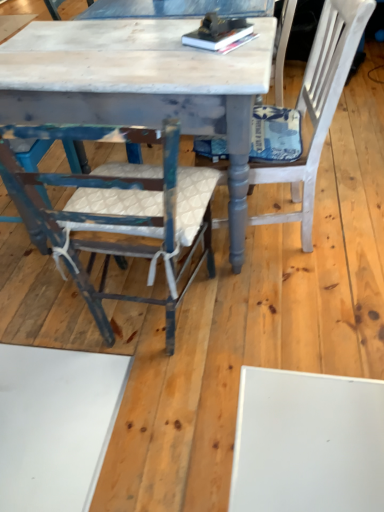
Question: Does white textured cushion at right, the first chair positioned from the right, have a larger size compared to hardcover books at center?

Choices:
 (A) no
 (B) yes

Answer: (B)

Question: Is white textured cushion at right, which is the second chair from left to right, surrounding hardcover books at center?

Choices:
 (A) no
 (B) yes

Answer: (B)

Question: Considering the relative sizes of white textured cushion at right, which is the second chair from left to right, and hardcover books at center in the image provided, is white textured cushion at right, which is the second chair from left to right, taller than hardcover books at center?

Choices:
 (A) no
 (B) yes

Answer: (B)

Question: Considering the relative sizes of white textured cushion at right, the first chair positioned from the right, and hardcover books at center in the image provided, is white textured cushion at right, the first chair positioned from the right, wider than hardcover books at center?

Choices:
 (A) no
 (B) yes

Answer: (B)

Question: From the image's perspective, would you say white textured cushion at right, the first chair positioned from the right, is shown under hardcover books at center?

Choices:
 (A) no
 (B) yes

Answer: (B)

Question: Looking at the image, does hardcover books at center seem bigger or smaller compared to distressed white marble table at center?

Choices:
 (A) small
 (B) big

Answer: (A)

Question: Is hardcover books at center situated inside distressed white marble table at center or outside?

Choices:
 (A) outside
 (B) inside

Answer: (B)

Question: Looking at their shapes, would you say hardcover books at center is wider or thinner than distressed white marble table at center?

Choices:
 (A) thin
 (B) wide

Answer: (A)

Question: Considering the positions of hardcover books at center and distressed white marble table at center in the image, is hardcover books at center taller or shorter than distressed white marble table at center?

Choices:
 (A) tall
 (B) short

Answer: (B)

Question: Relative to distressed blue wood chair at left, which is the first chair from left to right, is hardcover books at center in front or behind?

Choices:
 (A) behind
 (B) front

Answer: (A)

Question: Is point (215, 46) positioned closer to the camera than point (125, 133)?

Choices:
 (A) farther
 (B) closer

Answer: (A)

Question: Is hardcover books at center spatially inside distressed blue wood chair at left, which is the first chair from left to right, or outside of it?

Choices:
 (A) inside
 (B) outside

Answer: (B)

Question: Would you say hardcover books at center is to the left or to the right of distressed blue wood chair at left, the second chair viewed from the right, in the picture?

Choices:
 (A) right
 (B) left

Answer: (A)

Question: From a real-world perspective, is distressed blue wood chair at left, which is the first chair from left to right, above or below hardcover books at center?

Choices:
 (A) above
 (B) below

Answer: (B)

Question: Looking at their shapes, would you say distressed blue wood chair at left, which is the first chair from left to right, is wider or thinner than hardcover books at center?

Choices:
 (A) wide
 (B) thin

Answer: (A)